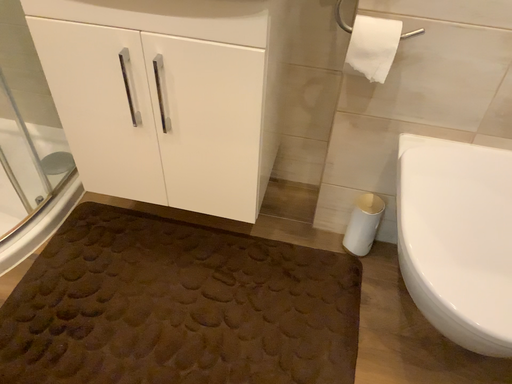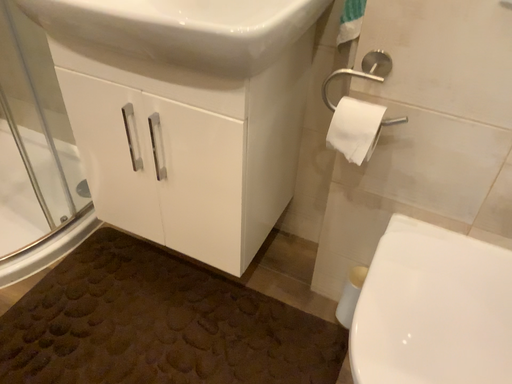
Question: How did the camera likely rotate when shooting the video?

Choices:
 (A) rotated left
 (B) rotated right

Answer: (A)